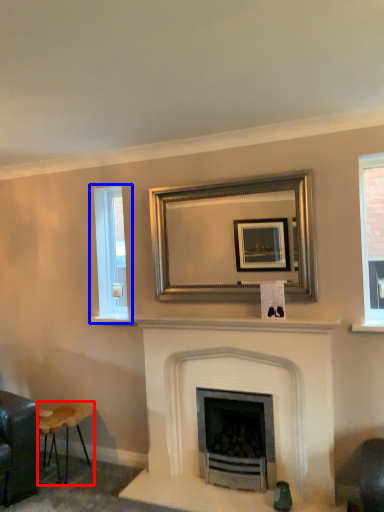
Question: Which object is further to the camera taking this photo, stool (highlighted by a red box) or window (highlighted by a blue box)?

Choices:
 (A) stool
 (B) window

Answer: (B)